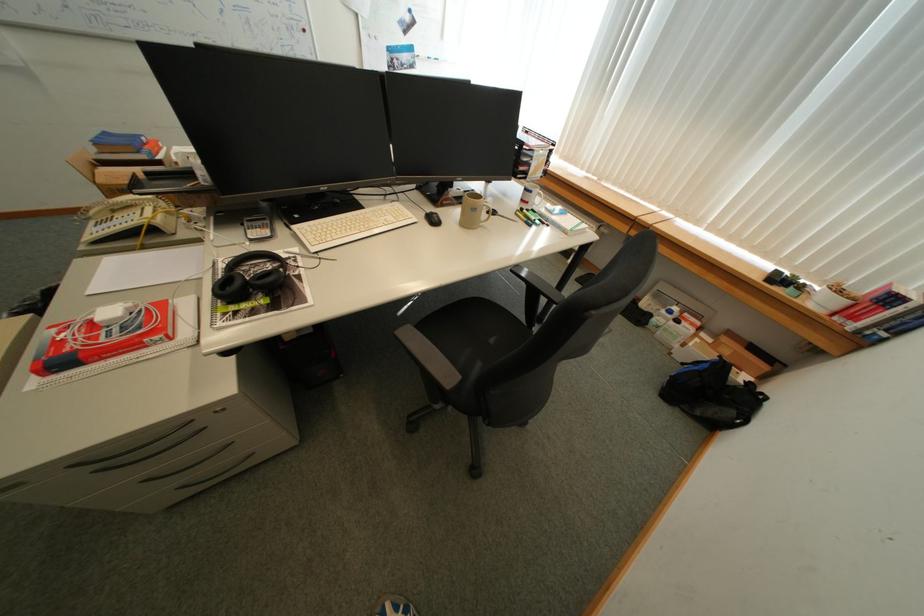
Find where to lift the telephone handset. Please return your answer as a coordinate pair (x, y).

(116, 205)